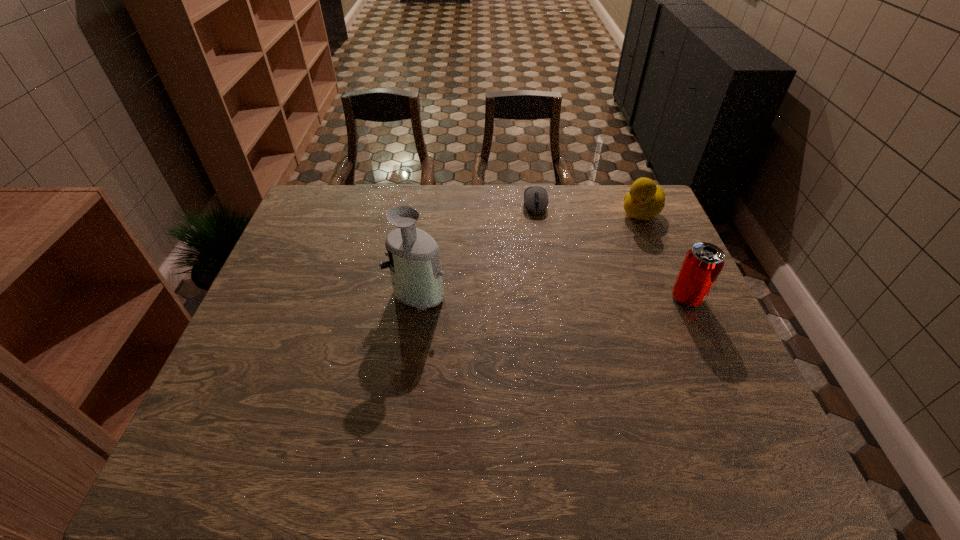
The height and width of the screenshot is (540, 960). In order to click on free spot on the desktop that is between the juicer and the third shortest object and is positioned on the front-facing side of the duck in this screenshot , I will do `click(537, 294)`.

The width and height of the screenshot is (960, 540). I want to click on free space on the desktop that is between the leftmost object and the second tallest object and is positioned on the wheel side of the third object from right to left, so click(543, 294).